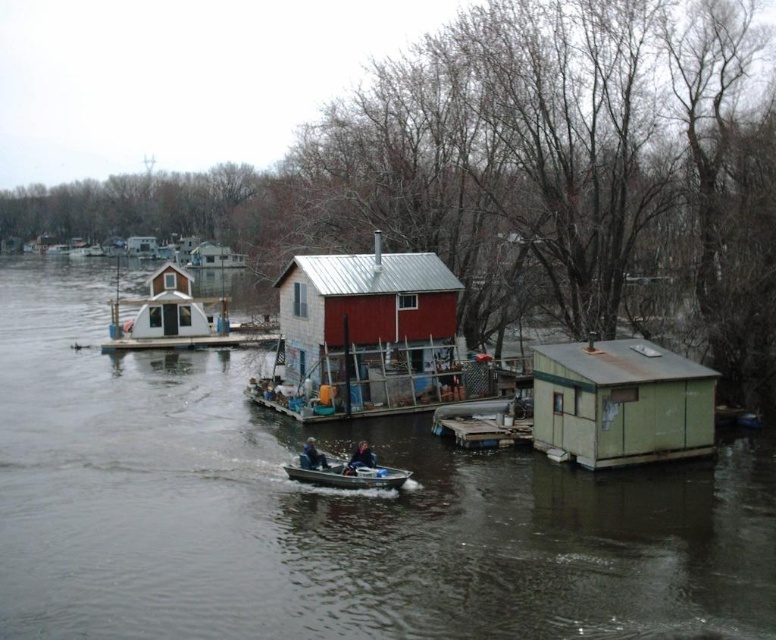
Question: Among these points, which one is nearest to the camera?

Choices:
 (A) (539, 417)
 (B) (338, 465)
 (C) (303, 566)

Answer: (C)

Question: Does green weathered cabin at right have a smaller size compared to blue fabric jacket at center?

Choices:
 (A) no
 (B) yes

Answer: (B)

Question: Is dark blue fabric jacket at center wider than white plastic hut at upper left?

Choices:
 (A) yes
 (B) no

Answer: (B)

Question: Based on their relative distances, which object is farther from the white plastic hut at upper left?

Choices:
 (A) metallic gray boat at center
 (B) brown wooden river at center

Answer: (A)

Question: Which point is farther to the camera?

Choices:
 (A) dark blue fabric jacket at center
 (B) green weathered cabin at right
 (C) white plastic hut at upper left
 (D) metallic gray boat at center

Answer: (C)

Question: Does brown wooden river at center have a lesser width compared to green weathered cabin at right?

Choices:
 (A) no
 (B) yes

Answer: (A)